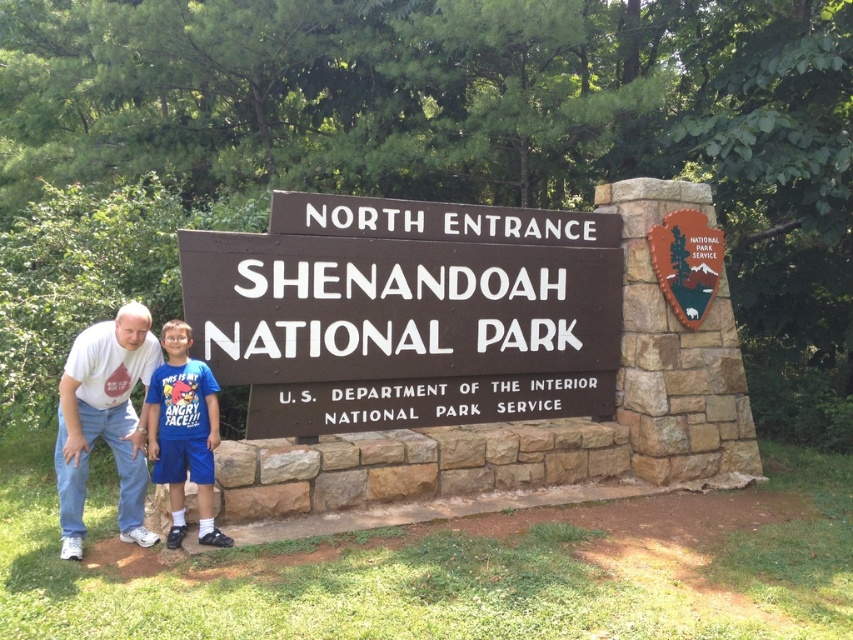
Identify the location of white t-shirt at lower left. (105, 420).

At what (x,y) coordinates should I click in order to perform the action: click on white t-shirt at lower left. Please return your answer as a coordinate pair (x, y). The height and width of the screenshot is (640, 853). Looking at the image, I should click on point(105,420).

How far apart are brown wooden sign at center and blue cotton shirt at center?

They are 1.12 meters apart.

Between point (364, 310) and point (180, 396), which one is positioned behind?

Point (364, 310)

Find the location of a particular element. The width and height of the screenshot is (853, 640). brown wooden sign at center is located at coordinates (407, 314).

Between brown wooden sign at center and white t-shirt at lower left, which one is positioned higher?

Positioned higher is brown wooden sign at center.

Is brown wooden sign at center above white t-shirt at lower left?

Yes.

Image resolution: width=853 pixels, height=640 pixels. Find the location of `brown wooden sign at center`. brown wooden sign at center is located at coordinates (407, 314).